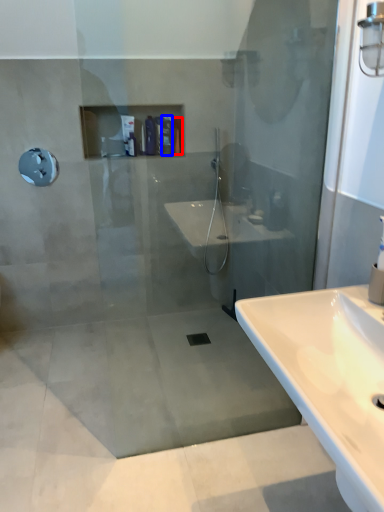
Question: Which object appears farthest to the camera in this image, toiletry (highlighted by a red box) or toiletry (highlighted by a blue box)?

Choices:
 (A) toiletry
 (B) toiletry

Answer: (A)